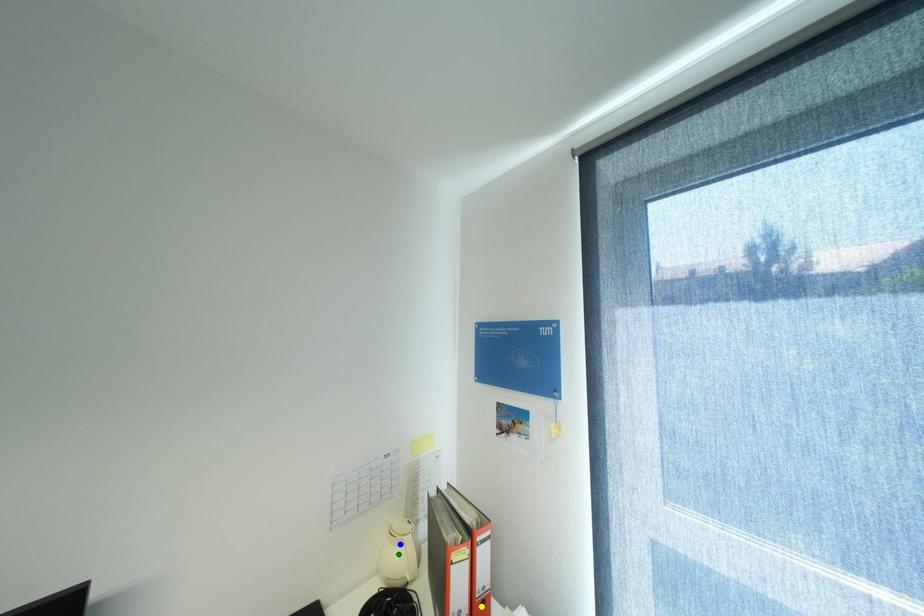
Order these from nearest to farthest:
blue point | yellow point | green point

yellow point → green point → blue point